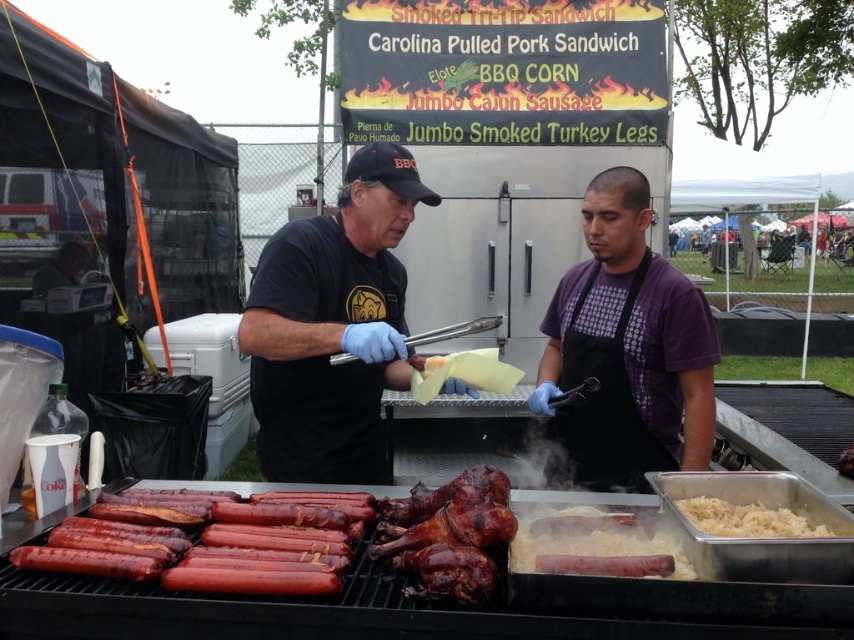
You are a customer at the barbecue event and want to order a sausage. Which object should you approach first, the black matte shirt at center or the smokey brown sausage at center?

The black matte shirt at center has a greater height compared to the smokey brown sausage at center, so you should approach the black matte shirt at center first as it is taller and likely represents the person cooking the sausages.

You are a food critic attending the barbecue event and notice the black matte shirt at center and the smokey brown sausage at center. Which object is positioned to the right of the other?

The smokey brown sausage at center is to the right of the black matte shirt at center.

You are at the barbecue event and see the black matte shirt at center. Where exactly is it located in terms of coordinates?

The black matte shirt at center is located at coordinates point (332, 324).